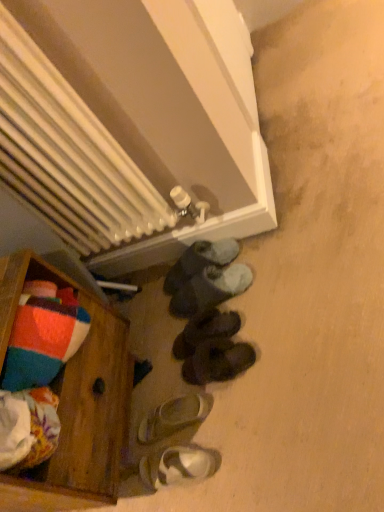
This screenshot has height=512, width=384. What are the coordinates of `vacant region to the right of white matte sandal at lower center, which is the fifth footwear from top to bottom` in the screenshot? It's located at (227, 394).